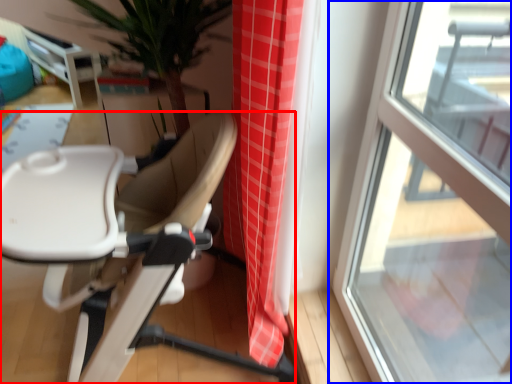
Question: Which of the following is the closest to the observer, chair (highlighted by a red box) or window (highlighted by a blue box)?

Choices:
 (A) chair
 (B) window

Answer: (B)